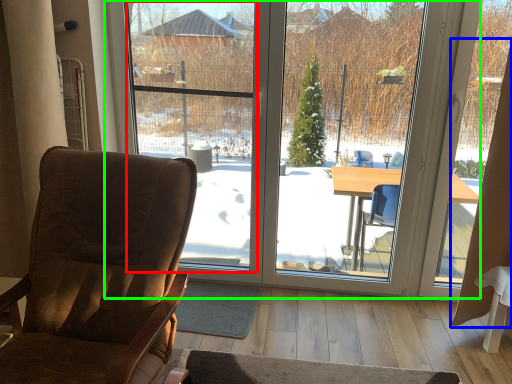
Question: Based on their relative distances, which object is farther from window screen (highlighted by a red box)? Choose from curtain (highlighted by a blue box) and window (highlighted by a green box).

Choices:
 (A) curtain
 (B) window

Answer: (A)